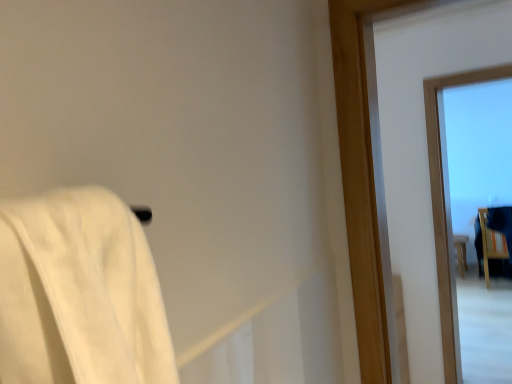
Question: From a real-world perspective, is transparent glass window at upper right over wooden chair at right, marked as the first furniture in a front-to-back arrangement?

Choices:
 (A) no
 (B) yes

Answer: (B)

Question: Is transparent glass window at upper right positioned behind wooden chair at right, marked as the first furniture in a front-to-back arrangement?

Choices:
 (A) yes
 (B) no

Answer: (B)

Question: Is transparent glass window at upper right not near wooden chair at right, which is the second furniture from back to front?

Choices:
 (A) yes
 (B) no

Answer: (A)

Question: Considering the relative positions of transparent glass window at upper right and wooden chair at right, marked as the first furniture in a front-to-back arrangement, in the image provided, is transparent glass window at upper right to the left of wooden chair at right, marked as the first furniture in a front-to-back arrangement, from the viewer's perspective?

Choices:
 (A) yes
 (B) no

Answer: (A)

Question: Is transparent glass window at upper right not inside wooden chair at right, marked as the first furniture in a front-to-back arrangement?

Choices:
 (A) no
 (B) yes

Answer: (B)

Question: Does point (431, 175) appear closer or farther from the camera than point (506, 258)?

Choices:
 (A) farther
 (B) closer

Answer: (B)

Question: Is transparent glass window at upper right taller or shorter than wooden chair at right, marked as the first furniture in a front-to-back arrangement?

Choices:
 (A) short
 (B) tall

Answer: (B)

Question: From a real-world perspective, is transparent glass window at upper right positioned above or below wooden chair at right, which is the second furniture from back to front?

Choices:
 (A) below
 (B) above

Answer: (B)

Question: Is transparent glass window at upper right spatially inside wooden chair at right, marked as the first furniture in a front-to-back arrangement, or outside of it?

Choices:
 (A) outside
 (B) inside

Answer: (A)

Question: From their relative heights in the image, would you say wooden stool at right, placed as the second furniture when sorted from front to back, is taller or shorter than transparent glass window at upper right?

Choices:
 (A) tall
 (B) short

Answer: (B)

Question: Considering their positions, is wooden stool at right, placed as the second furniture when sorted from front to back, located in front of or behind transparent glass window at upper right?

Choices:
 (A) behind
 (B) front

Answer: (A)

Question: From the image's perspective, relative to transparent glass window at upper right, is wooden stool at right, placed as the second furniture when sorted from front to back, above or below?

Choices:
 (A) below
 (B) above

Answer: (A)

Question: Looking at their shapes, would you say wooden stool at right, which is the 1th furniture in back-to-front order, is wider or thinner than transparent glass window at upper right?

Choices:
 (A) thin
 (B) wide

Answer: (B)

Question: Looking at their shapes, would you say wooden chair at right, marked as the first furniture in a front-to-back arrangement, is wider or thinner than wooden stool at right, which is the 1th furniture in back-to-front order?

Choices:
 (A) thin
 (B) wide

Answer: (B)

Question: From a real-world perspective, is wooden chair at right, marked as the first furniture in a front-to-back arrangement, above or below wooden stool at right, which is the 1th furniture in back-to-front order?

Choices:
 (A) above
 (B) below

Answer: (A)